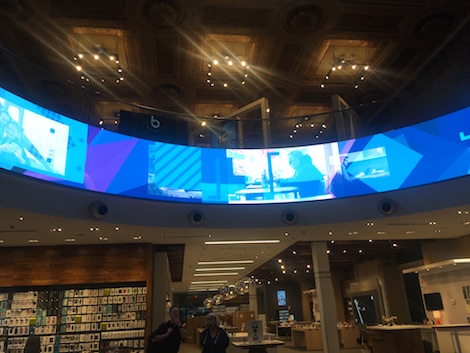
At what (x,y) coordinates should I click in order to perform the action: click on big shelf. Please return your answer as a coordinate pair (x, y). Looking at the image, I should click on (90, 270).